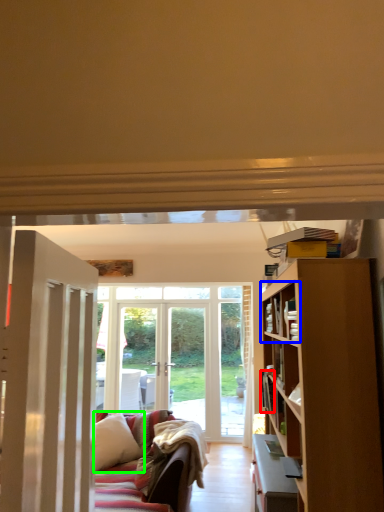
Question: Which is farther away from book (highlighted by a red box)? shelf (highlighted by a blue box) or pillow (highlighted by a green box)?

Choices:
 (A) shelf
 (B) pillow

Answer: (B)